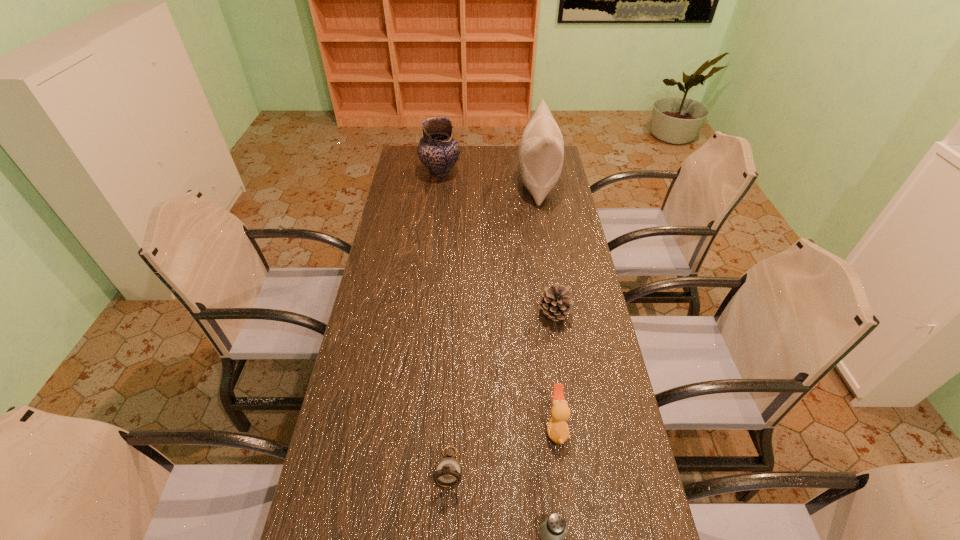
This screenshot has height=540, width=960. Find the location of `object that is at the far left corner`. object that is at the far left corner is located at coordinates (438, 151).

I want to click on object that is at the far right corner, so click(541, 153).

In the image, there is a desktop. Where is `vacant space at the far edge`? This screenshot has height=540, width=960. vacant space at the far edge is located at coordinates click(516, 148).

This screenshot has height=540, width=960. In the image, there is a desktop. In order to click on vacant space at the left edge in this screenshot , I will do `click(411, 226)`.

This screenshot has width=960, height=540. What are the coordinates of `vacant space at the right edge of the desktop` in the screenshot? It's located at (557, 201).

Find the location of `free area in between the duck and the compass`. free area in between the duck and the compass is located at coordinates (x=503, y=448).

Where is `free space that is in between the duck and the fifth shortest object`? This screenshot has width=960, height=540. free space that is in between the duck and the fifth shortest object is located at coordinates (498, 300).

Locate an element on the screen. Image resolution: width=960 pixels, height=540 pixels. vacant area that lies between the pinecone and the tallest object is located at coordinates (545, 248).

Where is `vacant point located between the pottery and the compass`? Image resolution: width=960 pixels, height=540 pixels. vacant point located between the pottery and the compass is located at coordinates (444, 320).

The image size is (960, 540). I want to click on vacant area that lies between the tallest object and the pottery, so 489,178.